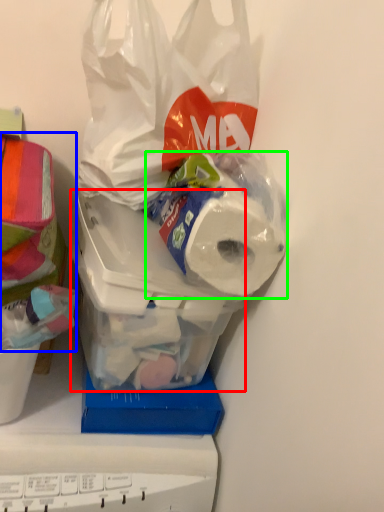
Question: Which object is positioned closest to wide (highlighted by a red box)? Select from wrapping paper (highlighted by a blue box) and toilet paper (highlighted by a green box).

Choices:
 (A) wrapping paper
 (B) toilet paper

Answer: (B)